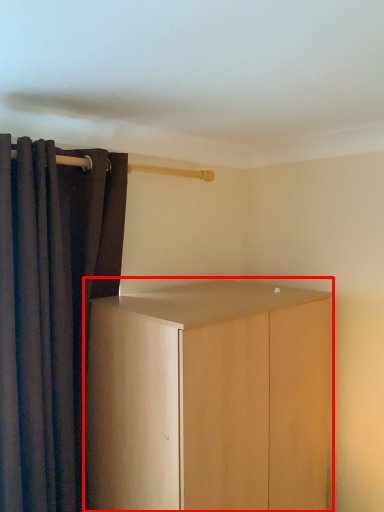
Question: In this image, where is cupboard (annotated by the red box) located relative to curtain?

Choices:
 (A) right
 (B) left

Answer: (A)